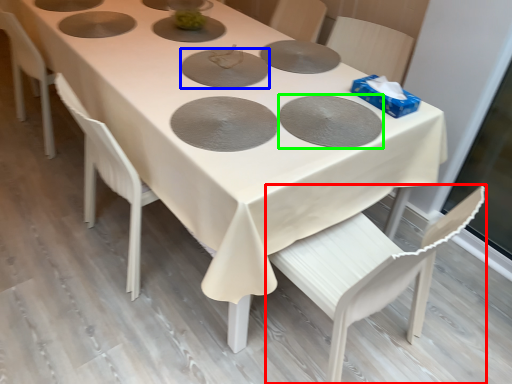
Question: Which object is the closest to the chair (highlighted by a red box)? Choose among these: pizza pan (highlighted by a blue box) or pizza pan (highlighted by a green box).

Choices:
 (A) pizza pan
 (B) pizza pan

Answer: (B)